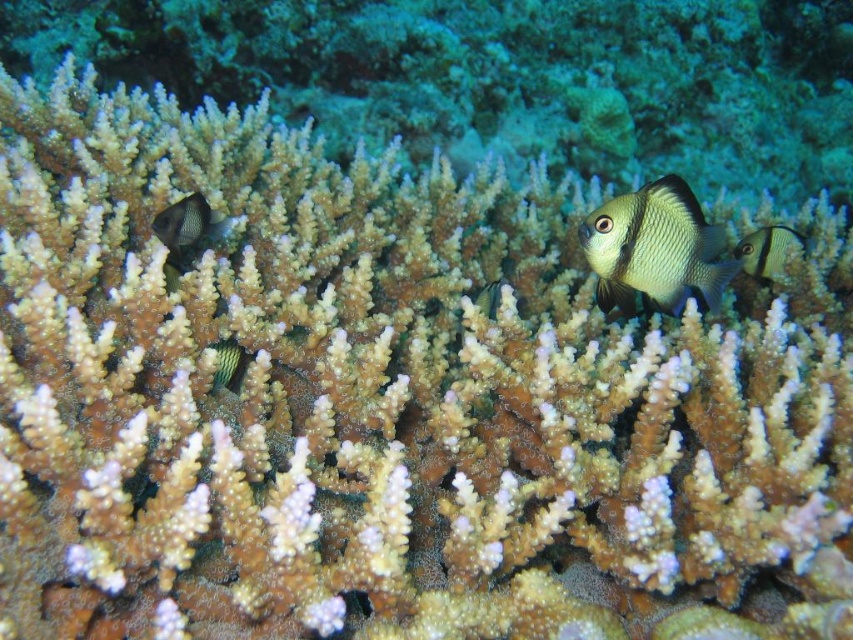
You are a marine biologist observing this underwater scene. You notice the shiny silver fish at center and the green striped fish at center. Which fish has a greater width?

The shiny silver fish at center has a greater width than the green striped fish at center.

You are a scuba diver swimming in the coral reef and you see two points in the water. The first point is at coordinates point (190, 228) and the second point is at point (763, 266). If you want to reach the point that is closer to you, which one should you swim towards?

Point (190, 228) is in front of point (763, 266), so you should swim towards point (190, 228) to reach the one closer to you.